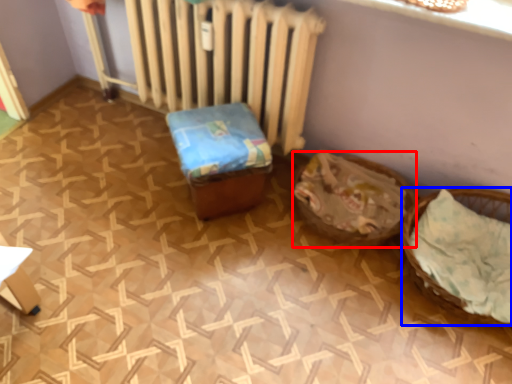
Question: Among these objects, which one is farthest to the camera, basket (highlighted by a red box) or basket (highlighted by a blue box)?

Choices:
 (A) basket
 (B) basket

Answer: (A)